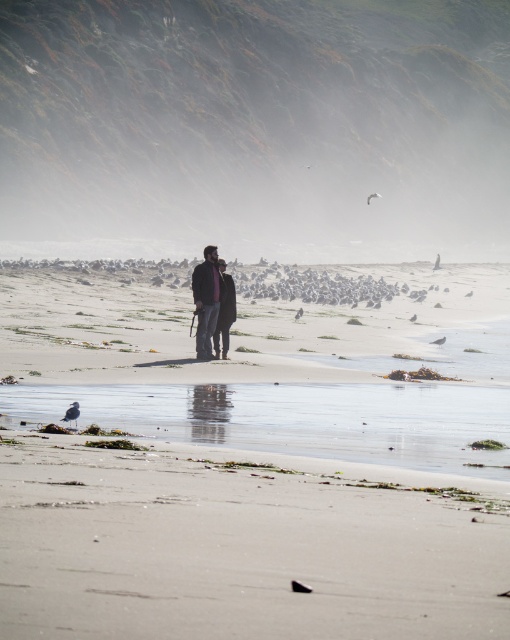
You are a photographer standing on the beach and want to capture both the foggy mist at upper center and the matte black jacket at center in a single photo. Given that your camera has a maximum focus range of 200 feet, will you be able to include both subjects in the same frame without moving?

The foggy mist at upper center and matte black jacket at center are 217.81 feet apart from each other. Since the distance exceeds the camera maximum focus range of 200 feet, you cannot capture both in the same frame without moving.

You are standing on the beach and want to walk towards the smooth sand at lower center. Will you pass through the foggy mist at upper center first?

Yes, you will pass through the foggy mist at upper center first because it is closer to you than the smooth sand at lower center.